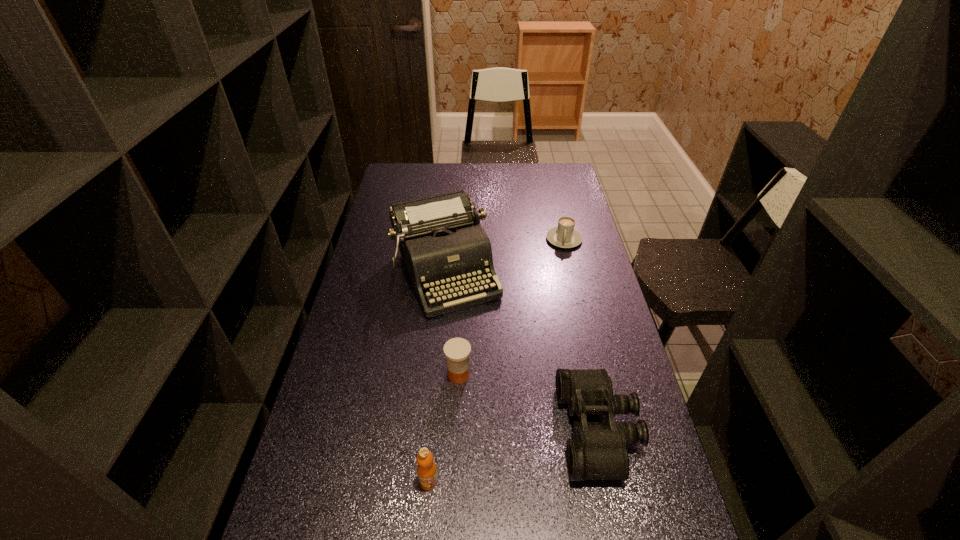
This screenshot has height=540, width=960. What are the coordinates of `cappuccino that is at the right edge` in the screenshot? It's located at (565, 236).

This screenshot has width=960, height=540. In the image, there is a desktop. Identify the location of vacant region at the far edge. (441, 184).

This screenshot has height=540, width=960. What are the coordinates of `vacant position at the left edge of the desktop` in the screenshot? It's located at (385, 226).

The height and width of the screenshot is (540, 960). In the image, there is a desktop. What are the coordinates of `free space at the right edge` in the screenshot? It's located at (603, 310).

Locate an element on the screen. Image resolution: width=960 pixels, height=540 pixels. free location at the far left corner of the desktop is located at coordinates (421, 176).

You are a GUI agent. You are given a task and a screenshot of the screen. Output one action in this format:
    pyautogui.click(x=<x>, y=<y>)
    Task: Click on the blank space at the far right corner of the desktop
    
    Given the screenshot: What is the action you would take?
    pyautogui.click(x=546, y=187)

Identify the location of free area in between the binoculars and the orange juice. The image size is (960, 540). (514, 455).

This screenshot has width=960, height=540. What are the coordinates of `vacant space in between the binoculars and the medicine` in the screenshot? It's located at (528, 402).

Where is `blank region between the medicine and the tallest object`? This screenshot has height=540, width=960. blank region between the medicine and the tallest object is located at coordinates (452, 323).

You are a GUI agent. You are given a task and a screenshot of the screen. Output one action in this format:
    pyautogui.click(x=<x>, y=<y>)
    Task: Click on the free point between the shortest object and the second tallest object
    
    Given the screenshot: What is the action you would take?
    pyautogui.click(x=496, y=360)